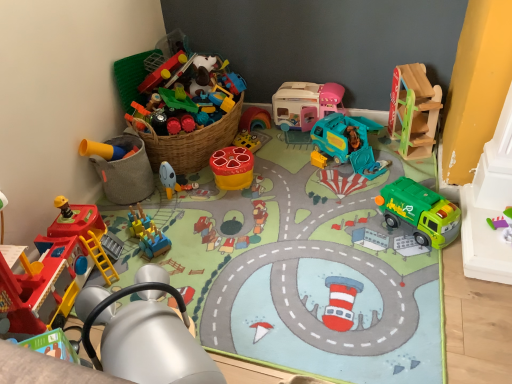
Where is `vacant space to the right of blue plastic train at center, which appears as the 2th toy when viewed from the left`? vacant space to the right of blue plastic train at center, which appears as the 2th toy when viewed from the left is located at coordinates pos(198,231).